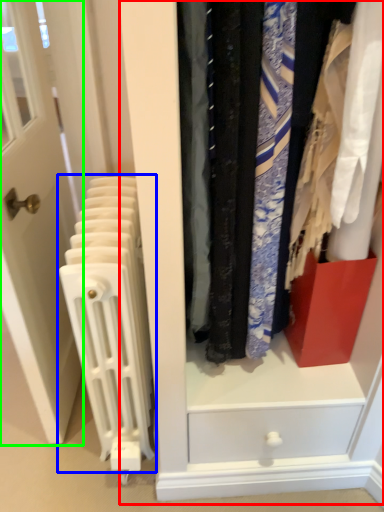
Question: Estimate the real-world distances between objects in this image. Which object is farther from dresser (highlighted by a red box), radiator (highlighted by a blue box) or door (highlighted by a green box)?

Choices:
 (A) radiator
 (B) door

Answer: (B)